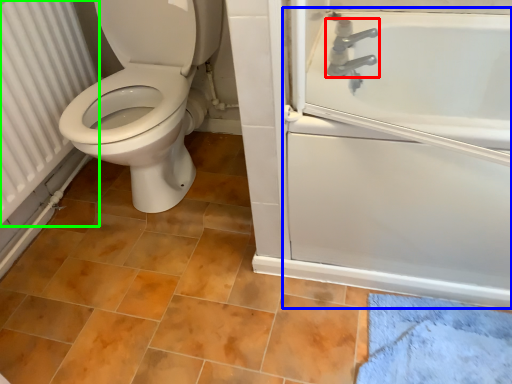
Question: Based on their relative distances, which object is nearer to tap (highlighted by a red box)? Choose from bath (highlighted by a blue box) and radiator (highlighted by a green box).

Choices:
 (A) bath
 (B) radiator

Answer: (A)